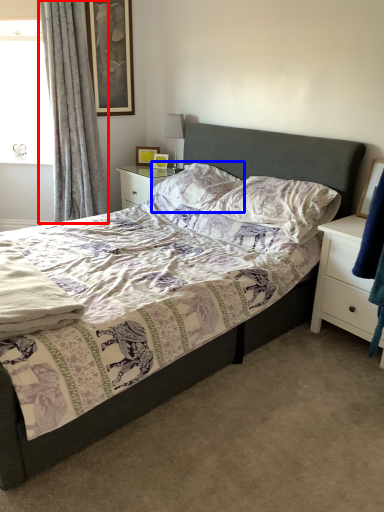
Question: Which of the following is the closest to the observer, curtain (highlighted by a red box) or pillow (highlighted by a blue box)?

Choices:
 (A) curtain
 (B) pillow

Answer: (B)